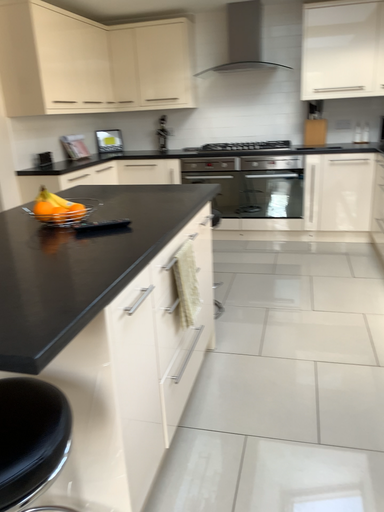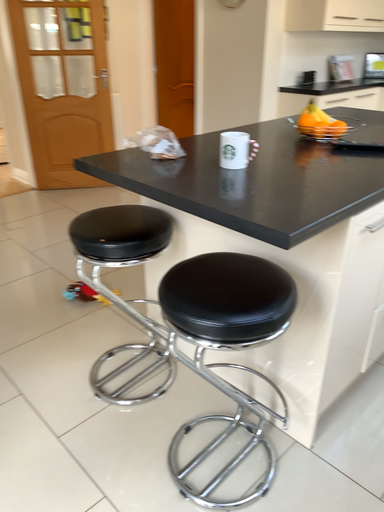
Question: Which way did the camera rotate in the video?

Choices:
 (A) rotated right
 (B) rotated left

Answer: (B)